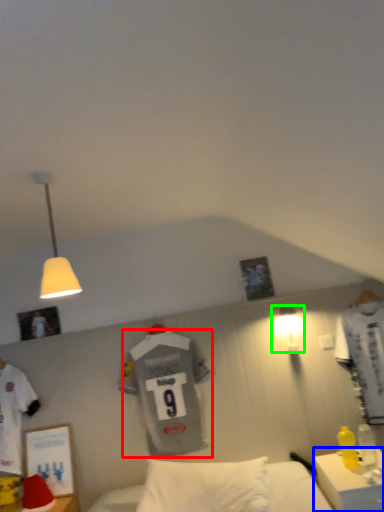
Question: Considering the real-world distances, which object is closest to t shirt (highlighted by a red box)? desk (highlighted by a blue box) or lamp (highlighted by a green box).

Choices:
 (A) desk
 (B) lamp

Answer: (B)